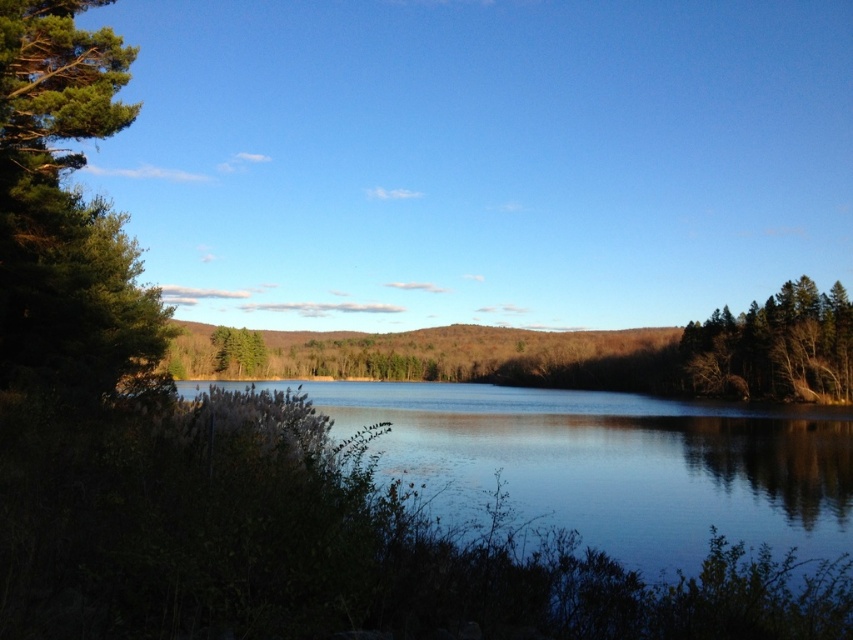
Is clear water at center positioned in front of green matte tree at center?

Yes, clear water at center is in front of green matte tree at center.

This screenshot has height=640, width=853. I want to click on clear water at center, so click(x=611, y=465).

Does green matte tree at right have a larger size compared to green matte tree at center?

Yes, green matte tree at right is bigger than green matte tree at center.

Which is below, green matte tree at right or green matte tree at center?

green matte tree at right

The height and width of the screenshot is (640, 853). Describe the element at coordinates (775, 348) in the screenshot. I see `green matte tree at right` at that location.

I want to click on green matte tree at right, so click(775, 348).

Is point (788, 525) behind point (724, 307)?

No, (788, 525) is closer to viewer.

Describe the element at coordinates (611, 465) in the screenshot. I see `clear water at center` at that location.

You are a GUI agent. You are given a task and a screenshot of the screen. Output one action in this format:
    pyautogui.click(x=<x>, y=<y>)
    Task: Click on the clear water at center
    
    Given the screenshot: What is the action you would take?
    pyautogui.click(x=611, y=465)